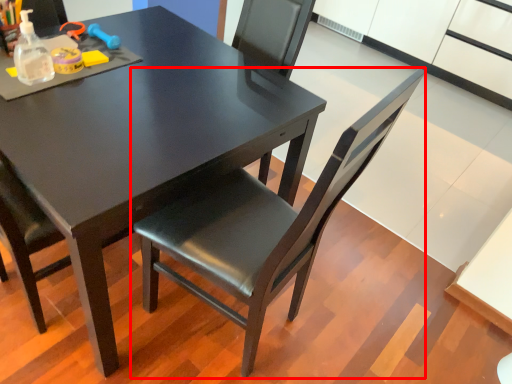
Question: From the image's perspective, where is chair (annotated by the red box) located relative to table?

Choices:
 (A) below
 (B) above

Answer: (A)